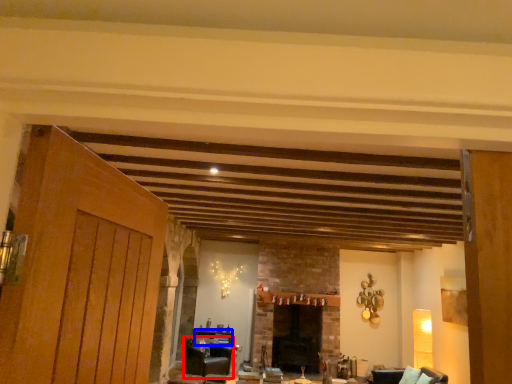
Question: Which point is closer to the camera, furniture (highlighted by a red box) or table (highlighted by a blue box)?

Choices:
 (A) furniture
 (B) table

Answer: (A)